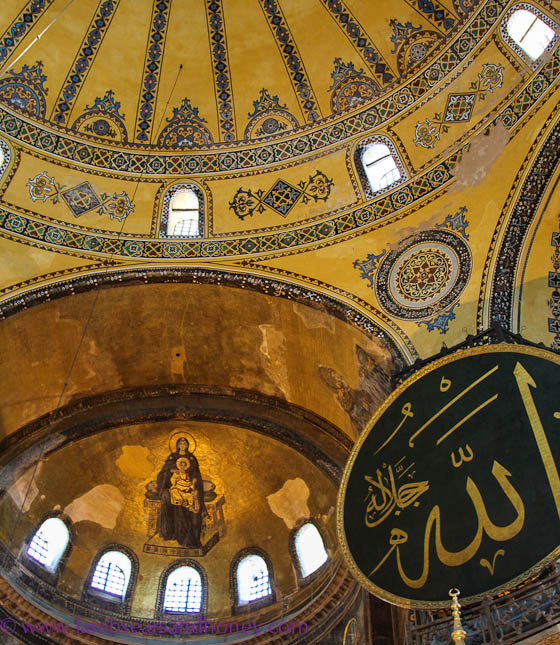
Find the location of a particular element. This screenshot has height=645, width=560. window is located at coordinates (120, 582).